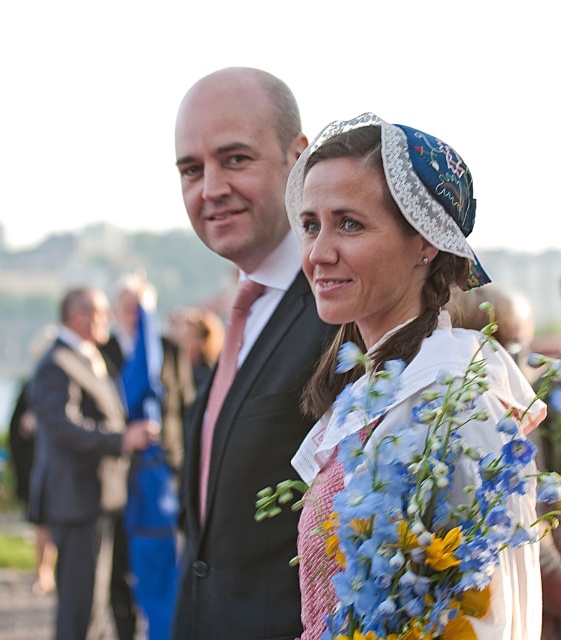
In the scene shown: You are a photographer adjusting the focus on your camera. You have two points in the image to focus on, point 1 at coordinates point [277,520] and point 2 at coordinates point [381,422]. If you want to focus on the closer object to the camera, which point should you choose?

Point [277,520] is closer to the camera than point [381,422], so you should choose point [277,520] to focus on the closer object.

You are a photographer setting up for an event. You notice the matte black suit at center and the embroidered fabric hat at center in your frame. Which object should you adjust your focus on to ensure the taller object is in sharp focus?

The matte black suit at center is much taller than the embroidered fabric hat at center, so you should adjust your focus on the matte black suit at center to ensure the taller object is in sharp focus.

You are standing at the event and want to hand a gift to the embroidered fabric hat at center. Since you can only reach up to 18 feet, will you be able to reach it?

The embroidered fabric hat at center is 20.22 feet away from viewer, so you cannot reach it since it is beyond your 18 feet reach limit.